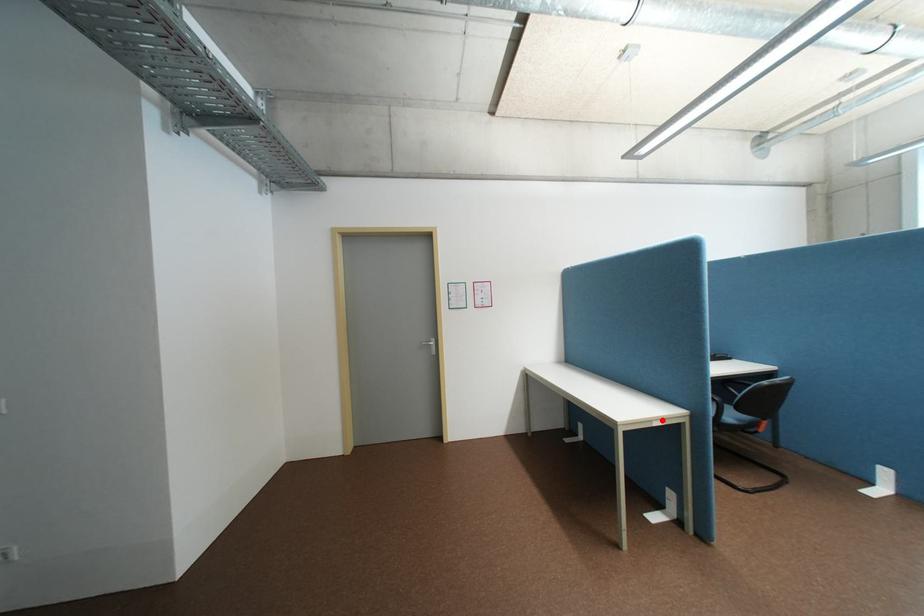
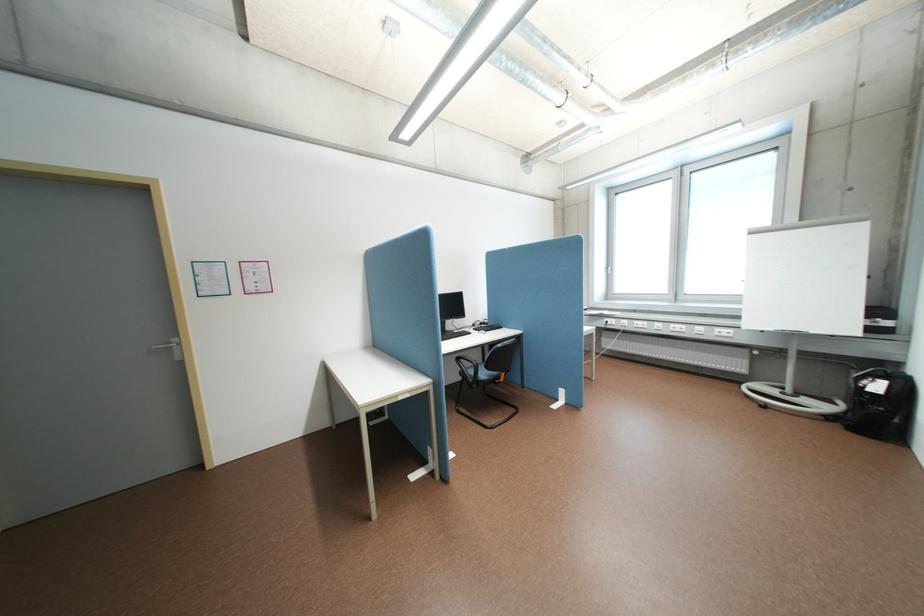
The point at the highlighted location is marked in the first image. Where is the corresponding point in the second image?

(407, 395)